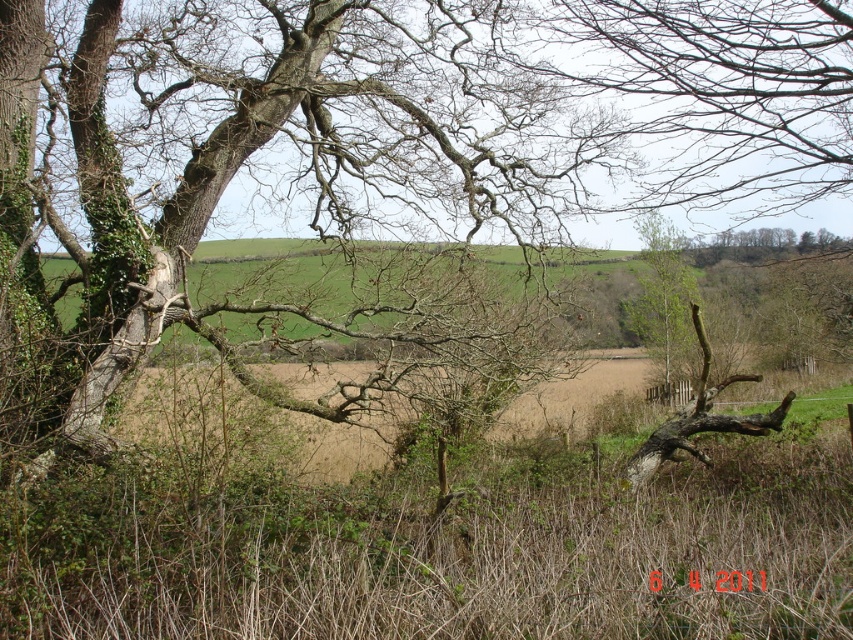
Question: Which point is farther from the camera taking this photo?

Choices:
 (A) (418, 4)
 (B) (663, 353)

Answer: (B)

Question: Which of the following is the closest to the observer?

Choices:
 (A) green leafy tree at center
 (B) smooth bark tree at left

Answer: (B)

Question: Which point is closer to the camera taking this photo?

Choices:
 (A) (683, 285)
 (B) (122, 204)

Answer: (B)

Question: Is smooth bark tree at left positioned behind green leafy tree at center?

Choices:
 (A) yes
 (B) no

Answer: (B)

Question: Considering the relative positions of smooth bark tree at left and green leafy tree at center in the image provided, where is smooth bark tree at left located with respect to green leafy tree at center?

Choices:
 (A) left
 (B) right

Answer: (A)

Question: Is smooth bark tree at left below green leafy tree at center?

Choices:
 (A) yes
 (B) no

Answer: (B)